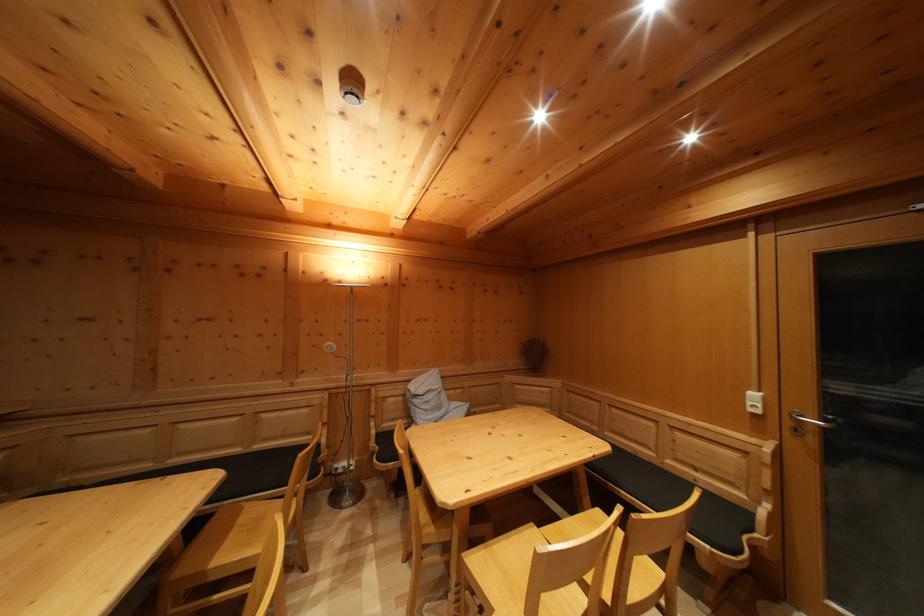
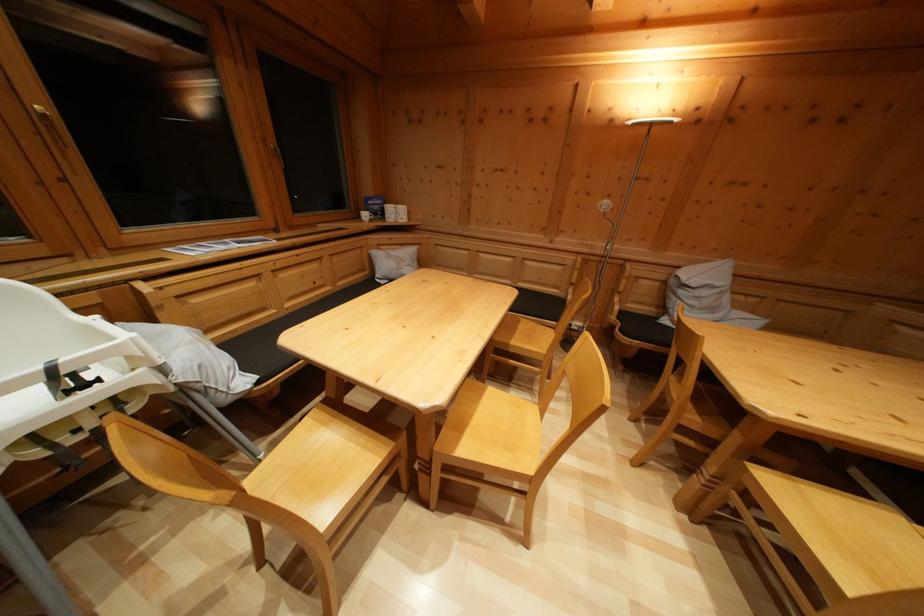
The images are taken continuously from a first-person perspective. In which direction is your viewpoint rotating?

The rotation direction of the camera is left-down.